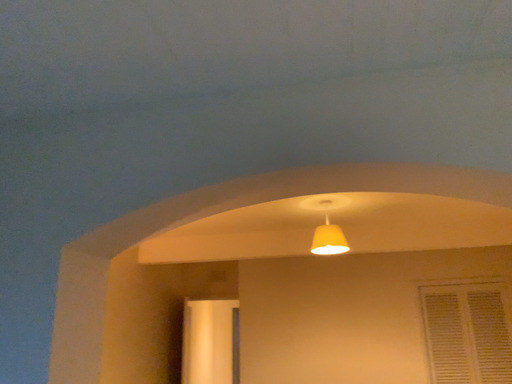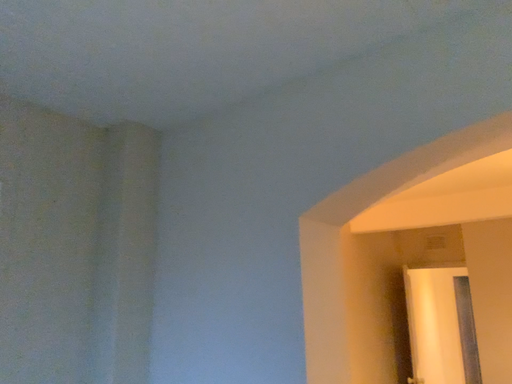
Question: Which way did the camera rotate in the video?

Choices:
 (A) rotated left
 (B) rotated right

Answer: (A)